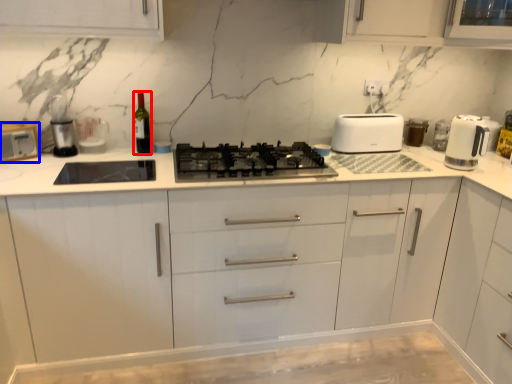
Question: Which point is further to the camera, wine bottle (highlighted by a red box) or toaster (highlighted by a blue box)?

Choices:
 (A) wine bottle
 (B) toaster

Answer: (A)